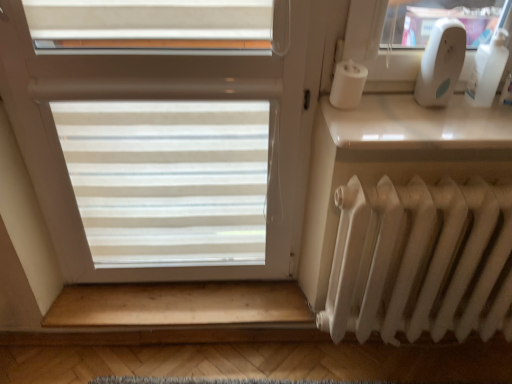
Locate an element on the screen. unoccupied area in front of white plastic bottle at upper right is located at coordinates [490, 124].